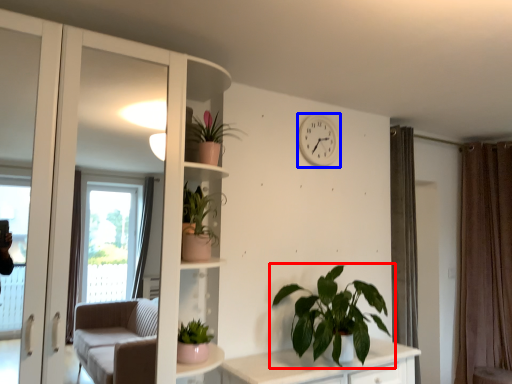
Question: Which object is closer to the camera taking this photo, houseplant (highlighted by a red box) or clock (highlighted by a blue box)?

Choices:
 (A) houseplant
 (B) clock

Answer: (A)